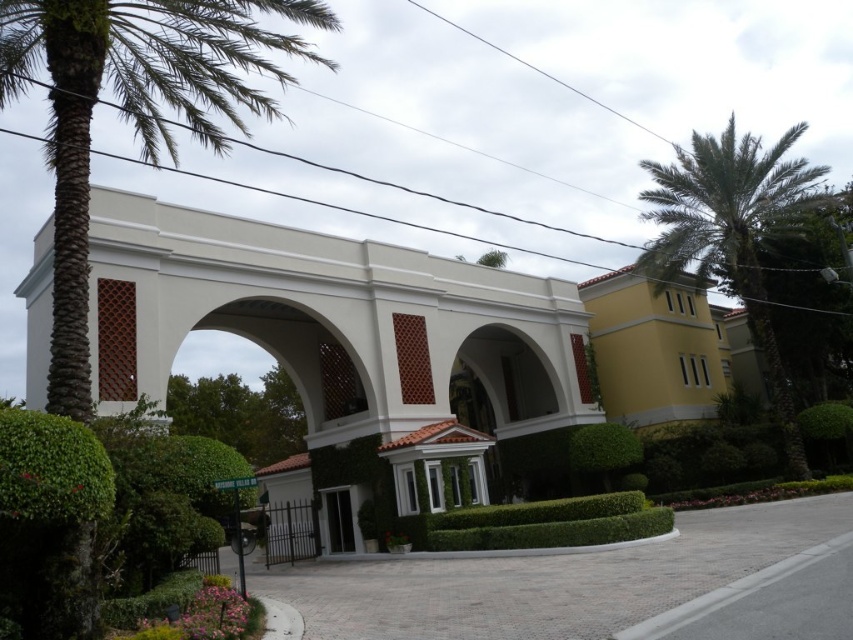
Question: Considering the real-world distances, which object is closest to the green leafy hedge at center?

Choices:
 (A) green leafy palm tree at left
 (B) yellow matte building at upper right
 (C) black glass door at center
 (D) green leafy palm tree at upper right

Answer: (C)

Question: Does green leafy hedge at center have a greater width compared to black glass door at center?

Choices:
 (A) no
 (B) yes

Answer: (A)

Question: Estimate the real-world distances between objects in this image. Which object is closer to the green leafy palm tree at upper right?

Choices:
 (A) white concrete archway at center
 (B) yellow matte building at upper right

Answer: (B)

Question: Is green leafy palm tree at left further to the viewer compared to green leafy palm tree at upper right?

Choices:
 (A) yes
 (B) no

Answer: (B)

Question: Does green leafy palm tree at left appear over yellow matte building at upper right?

Choices:
 (A) yes
 (B) no

Answer: (A)

Question: Which point appears farthest from the camera in this image?

Choices:
 (A) (x=341, y=488)
 (B) (x=155, y=298)

Answer: (A)